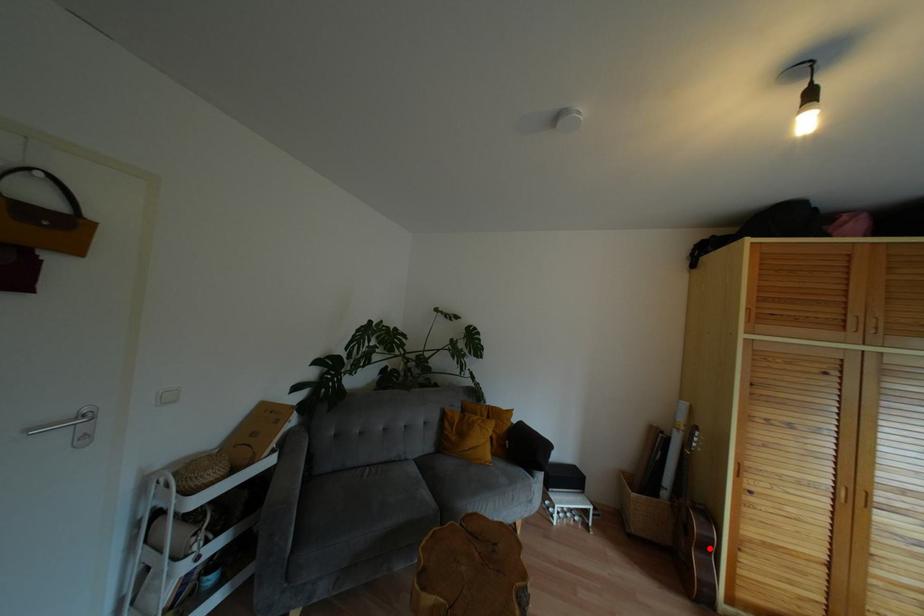
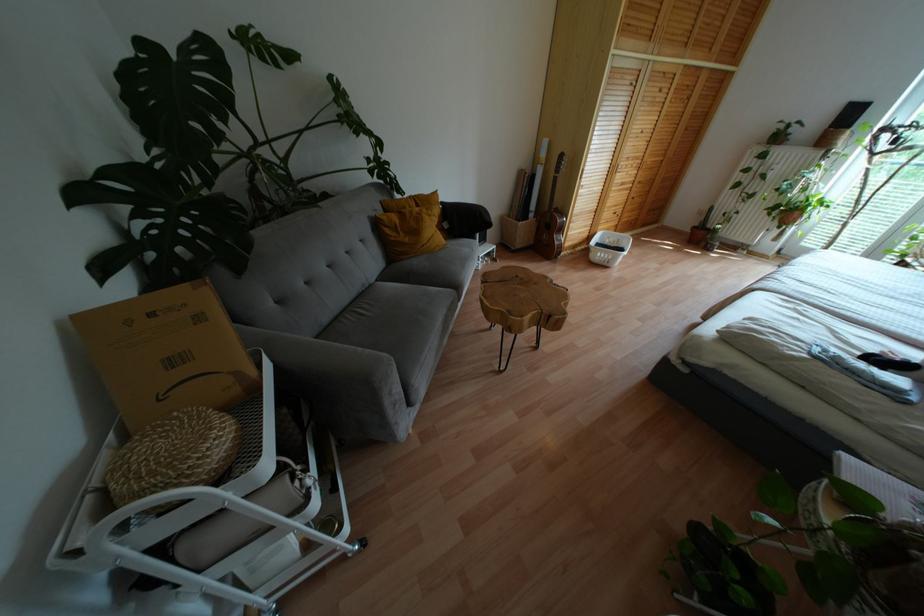
Find the pixel in the second image that matches the highlighted location in the first image.

(560, 229)